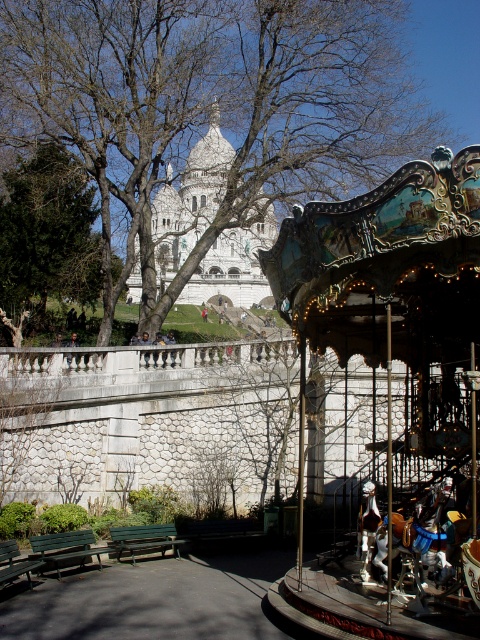
Between point (82, 536) and point (7, 579), which one is positioned in front?

Point (7, 579)

Which of these two, green wood bench at lower left or green wooden bench at lower left, stands shorter?

Standing shorter between the two is green wood bench at lower left.

This screenshot has height=640, width=480. What do you see at coordinates (66, 548) in the screenshot? I see `green wood bench at lower left` at bounding box center [66, 548].

Identify the location of green wood bench at lower left. The height and width of the screenshot is (640, 480). (66, 548).

Is brown leafless tree at center closer to the viewer compared to green leafy tree at upper left?

Yes, it is in front of green leafy tree at upper left.

Is brown leafless tree at center taller than green leafy tree at upper left?

Yes.

Image resolution: width=480 pixels, height=640 pixels. Find the location of `brown leafless tree at center`. brown leafless tree at center is located at coordinates (211, 97).

Is shiny teal carousel at right thinner than green leafy tree at upper left?

Incorrect, shiny teal carousel at right's width is not less than green leafy tree at upper left's.

Can you confirm if shiny teal carousel at right is positioned above green leafy tree at upper left?

Actually, shiny teal carousel at right is below green leafy tree at upper left.

Is point (346, 232) positioned in front of point (15, 232)?

Yes, point (346, 232) is closer to viewer.

The height and width of the screenshot is (640, 480). In order to click on shiny teal carousel at right in this screenshot , I will do `click(399, 358)`.